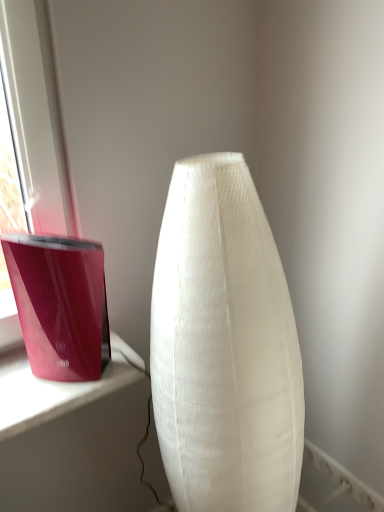
This screenshot has height=512, width=384. What do you see at coordinates (224, 347) in the screenshot?
I see `white fabric lamp at center` at bounding box center [224, 347].

You are a GUI agent. You are given a task and a screenshot of the screen. Output one action in this format:
    pyautogui.click(x=<x>, y=<y>)
    Task: Click on the white fabric lamp at center
    The image size is (384, 512).
    Given the screenshot: What is the action you would take?
    pyautogui.click(x=224, y=347)

You are a GUI agent. You are given a task and a screenshot of the screen. Output one action in this format:
    pyautogui.click(x=<x>, y=<y>)
    Task: Click on the glossy plastic candle holder at left
    The width and height of the screenshot is (384, 512).
    Given the screenshot: What is the action you would take?
    pyautogui.click(x=60, y=304)

The height and width of the screenshot is (512, 384). Describe the element at coordinates (60, 304) in the screenshot. I see `glossy plastic candle holder at left` at that location.

The image size is (384, 512). Identify the location of white fabric lamp at center. (224, 347).

Does glossy plastic candle holder at left appear on the left side of white fabric lamp at center?

Indeed, glossy plastic candle holder at left is positioned on the left side of white fabric lamp at center.

Is glossy plastic candle holder at left behind white fabric lamp at center?

Yes, the depth of glossy plastic candle holder at left is greater than that of white fabric lamp at center.

Is point (46, 340) farther from viewer compared to point (234, 472)?

Yes, point (46, 340) is farther from viewer.

From the image's perspective, which one is positioned lower, glossy plastic candle holder at left or white fabric lamp at center?

white fabric lamp at center.

From a real-world perspective, who is located higher, glossy plastic candle holder at left or white fabric lamp at center?

From a 3D spatial view, glossy plastic candle holder at left is above.

Is glossy plastic candle holder at left thinner than white fabric lamp at center?

Yes, glossy plastic candle holder at left is thinner than white fabric lamp at center.

Does glossy plastic candle holder at left have a lesser height compared to white fabric lamp at center?

Yes.

Between glossy plastic candle holder at left and white fabric lamp at center, which one has smaller size?

glossy plastic candle holder at left is smaller.

Can we say glossy plastic candle holder at left lies outside white fabric lamp at center?

That's correct, glossy plastic candle holder at left is outside of white fabric lamp at center.

In the scene shown: Is glossy plastic candle holder at left far from white fabric lamp at center?

glossy plastic candle holder at left is actually quite close to white fabric lamp at center.

Could you tell me if glossy plastic candle holder at left is facing white fabric lamp at center?

No, glossy plastic candle holder at left does not turn towards white fabric lamp at center.

What's the angular difference between glossy plastic candle holder at left and white fabric lamp at center's facing directions?

They differ by 88.1 degrees in their facing directions.

The height and width of the screenshot is (512, 384). In the image, there is a white fabric lamp at center. Find the location of `candle holder above it (from the image's perspective)`. candle holder above it (from the image's perspective) is located at coordinates (60, 304).

Considering the positions of objects white fabric lamp at center and glossy plastic candle holder at left in the image provided, who is more to the left, white fabric lamp at center or glossy plastic candle holder at left?

Positioned to the left is glossy plastic candle holder at left.

Is white fabric lamp at center in front of or behind glossy plastic candle holder at left in the image?

Visually, white fabric lamp at center is located in front of glossy plastic candle holder at left.

Is point (185, 184) positioned before point (105, 320)?

Yes, point (185, 184) is in front of point (105, 320).

Based on the photo, from the image's perspective, which one is positioned higher, white fabric lamp at center or glossy plastic candle holder at left?

glossy plastic candle holder at left, from the image's perspective.

From a real-world perspective, does white fabric lamp at center stand above glossy plastic candle holder at left?

No, from a real-world perspective, white fabric lamp at center is not above glossy plastic candle holder at left.

Between white fabric lamp at center and glossy plastic candle holder at left, which one has larger width?

With larger width is white fabric lamp at center.

Considering the sizes of objects white fabric lamp at center and glossy plastic candle holder at left in the image provided, who is taller, white fabric lamp at center or glossy plastic candle holder at left?

white fabric lamp at center is taller.

In terms of size, does white fabric lamp at center appear bigger or smaller than glossy plastic candle holder at left?

Considering their sizes, white fabric lamp at center takes up more space than glossy plastic candle holder at left.

Would you say white fabric lamp at center is inside or outside glossy plastic candle holder at left?

white fabric lamp at center exists outside the volume of glossy plastic candle holder at left.

Is white fabric lamp at center positioned far away from glossy plastic candle holder at left?

They are positioned close to each other.

Is white fabric lamp at center oriented away from glossy plastic candle holder at left?

No, glossy plastic candle holder at left is not at the back of white fabric lamp at center.

What's the angular difference between white fabric lamp at center and glossy plastic candle holder at left's facing directions?

The angular difference between white fabric lamp at center and glossy plastic candle holder at left is 88.1 degrees.

How distant is white fabric lamp at center from glossy plastic candle holder at left?

The distance of white fabric lamp at center from glossy plastic candle holder at left is 10.05 inches.

The image size is (384, 512). I want to click on candle holder behind the white fabric lamp at center, so click(x=60, y=304).

Find the location of a particular element. lamp on the right of the glossy plastic candle holder at left is located at coordinates (224, 347).

Identify the location of candle holder on the left of white fabric lamp at center. The height and width of the screenshot is (512, 384). (60, 304).